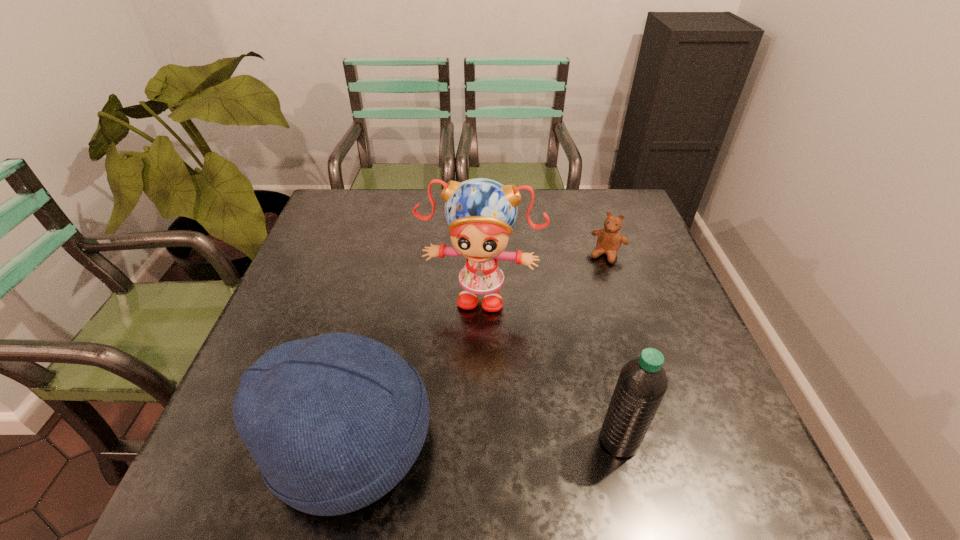
You are a GUI agent. You are given a task and a screenshot of the screen. Output one action in this format:
    pyautogui.click(x=<x>, y=<y>)
    Task: Click on the free space on the desktop that is between the skullcap and the water bottle and is positioned on the face of the farthest object
    The width and height of the screenshot is (960, 540).
    Given the screenshot: What is the action you would take?
    pyautogui.click(x=518, y=441)

This screenshot has height=540, width=960. I want to click on free space on the desktop that is between the skullcap and the third object from left to right and is positioned on the face of the tallest object, so click(451, 441).